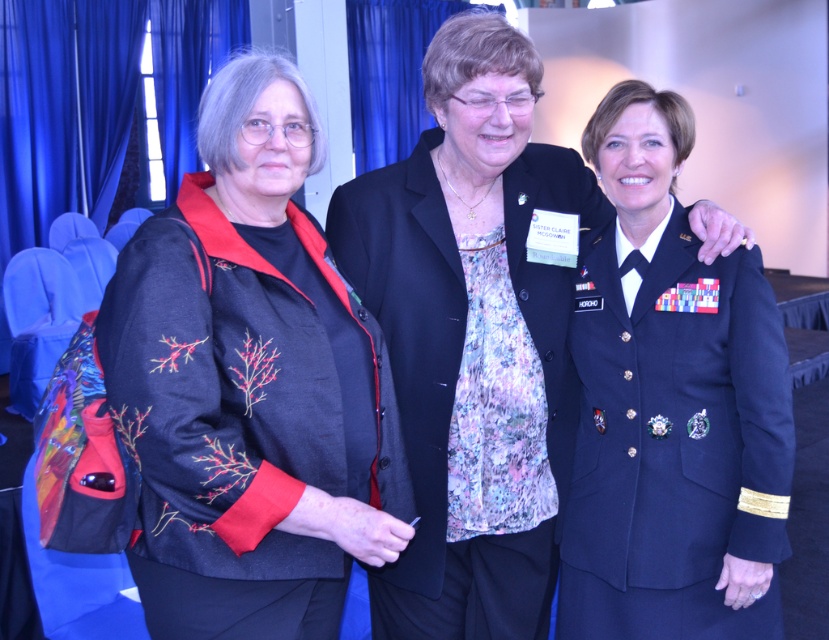
Is point (230, 300) farther from camera compared to point (735, 321)?

No, (230, 300) is in front of (735, 321).

At what (x,y) coordinates should I click in order to perform the action: click on embroidered fabric jacket at center. Please return your answer as a coordinate pair (x, y). This screenshot has width=829, height=640. Looking at the image, I should click on (236, 417).

Looking at this image, does embroidered fabric jacket at center come in front of navy blue fabric military uniform at center?

Yes, it is in front of navy blue fabric military uniform at center.

Between point (221, 618) and point (560, 392), which one is positioned in front?

Point (221, 618) is in front.

Does point (260, 588) come farther from viewer compared to point (568, 456)?

No, it is not.

Locate an element on the screen. The image size is (829, 640). embroidered fabric jacket at center is located at coordinates (236, 417).

Who is more distant from viewer, (x=696, y=628) or (x=365, y=205)?

Point (x=365, y=205)

How much distance is there between navy blue fabric military uniform at right and navy blue fabric military uniform at center?

navy blue fabric military uniform at right is 9.72 inches from navy blue fabric military uniform at center.

Image resolution: width=829 pixels, height=640 pixels. Find the location of `navy blue fabric military uniform at right`. navy blue fabric military uniform at right is located at coordinates (674, 444).

You are a GUI agent. You are given a task and a screenshot of the screen. Output one action in this format:
    pyautogui.click(x=<x>, y=<y>)
    Task: Click on the navy blue fabric military uniform at right
    The height and width of the screenshot is (640, 829).
    Given the screenshot: What is the action you would take?
    pyautogui.click(x=674, y=444)